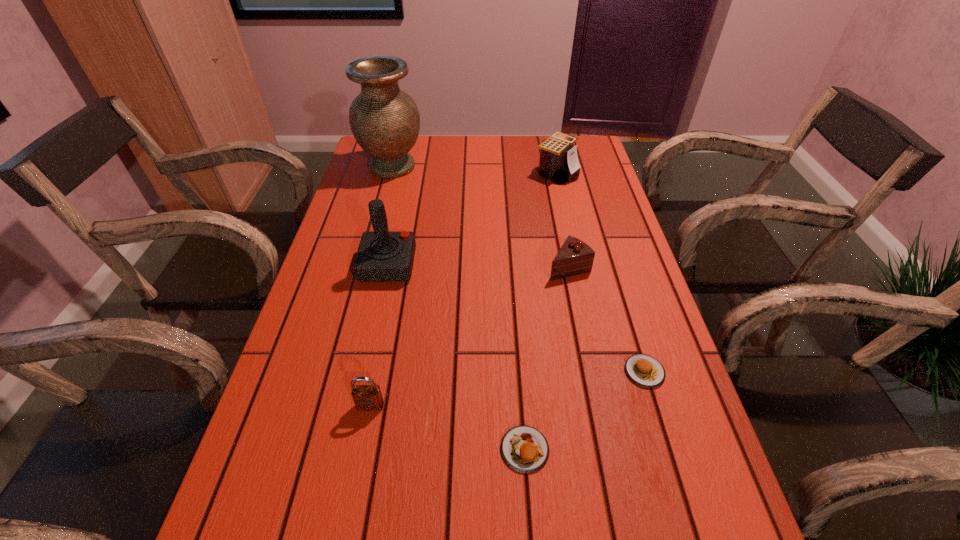
Identify the location of vacant space located on the base of the sixth shortest object. (504, 265).

This screenshot has width=960, height=540. In order to click on vacant space situated 0.360m on the left of the calculator in this screenshot , I will do `click(423, 173)`.

I want to click on free region located 0.210m on the front-facing side of the padlock, so click(347, 533).

I want to click on free region located on the right of the chocolate cake, so click(x=617, y=267).

Where is `free region located 0.270m on the right of the nearest object`? The height and width of the screenshot is (540, 960). free region located 0.270m on the right of the nearest object is located at coordinates (699, 449).

I want to click on vacant area situated on the back of the right food, so click(609, 254).

Identify the location of vase that is at the far edge. The width and height of the screenshot is (960, 540). (384, 120).

The height and width of the screenshot is (540, 960). Find the location of `calculator that is positioned at the far edge`. calculator that is positioned at the far edge is located at coordinates (558, 162).

Locate an element on the screen. This screenshot has height=540, width=960. vase that is positioned at the left edge is located at coordinates (384, 120).

Where is `joystick situated at the left edge`? This screenshot has height=540, width=960. joystick situated at the left edge is located at coordinates (383, 256).